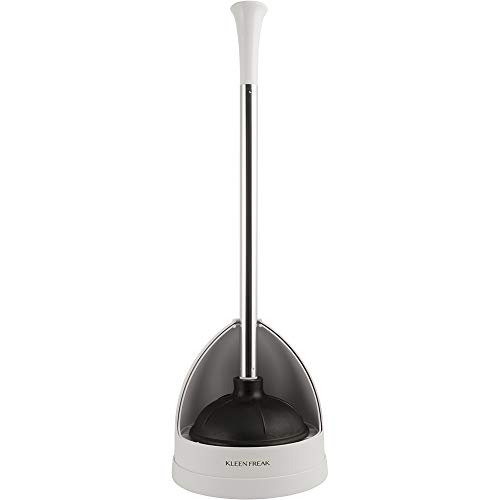
Locate an element on the screen. The width and height of the screenshot is (500, 500). rubber end of plunger is located at coordinates (240, 436).